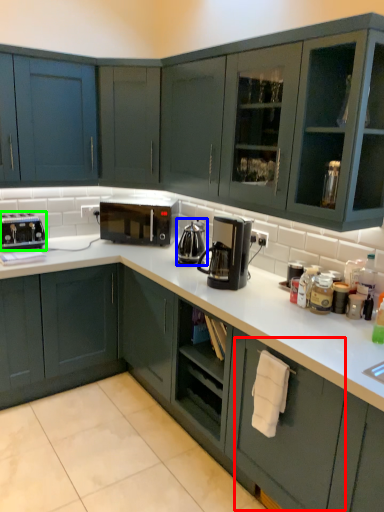
Question: Based on their relative distances, which object is farther from drawer (highlighted by a red box)? Choose from coffeepot (highlighted by a blue box) and kitchen appliance (highlighted by a green box).

Choices:
 (A) coffeepot
 (B) kitchen appliance

Answer: (B)